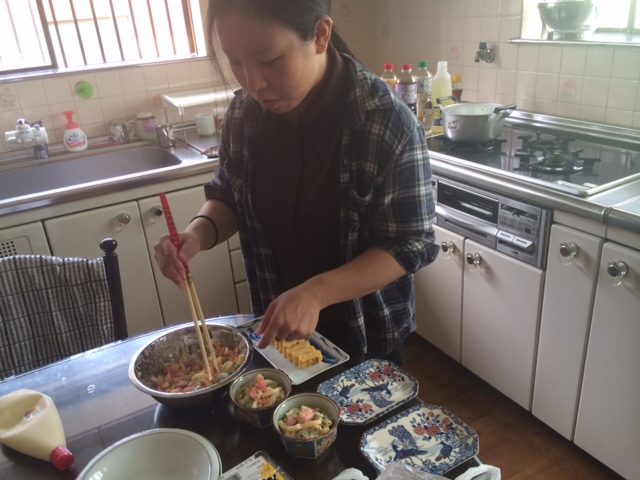
Where is `door handles`? Image resolution: width=640 pixels, height=480 pixels. door handles is located at coordinates (616, 270), (564, 250), (476, 260), (442, 246), (156, 212), (127, 219).